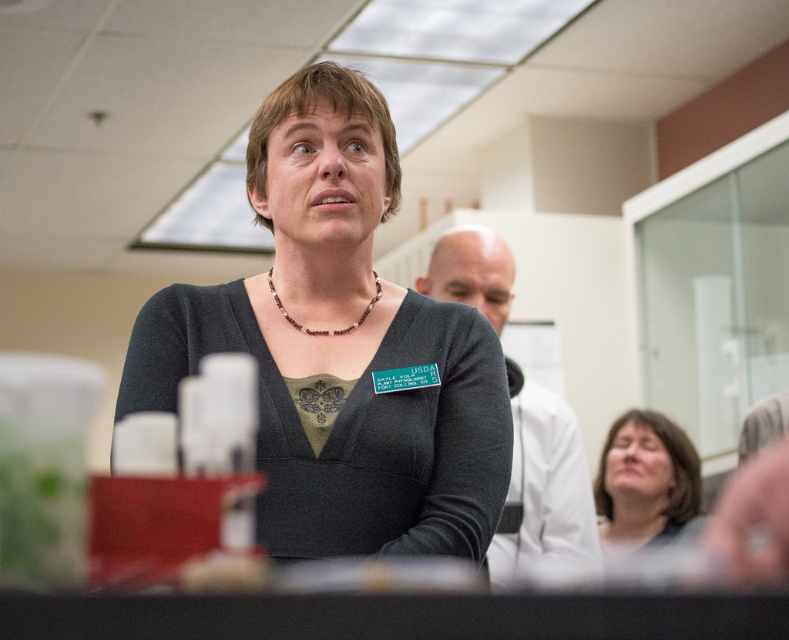
Based on the photo, does matte black sweater at center appear on the right side of matte gray sweater at lower right?

No, matte black sweater at center is not to the right of matte gray sweater at lower right.

Between point (440, 348) and point (647, 468), which one is positioned behind?

The point (647, 468) is behind.

Identify the location of matte black sweater at center. (350, 417).

Is matte gray sweater at lower right above multicolored beaded necklace at center?

No, matte gray sweater at lower right is not above multicolored beaded necklace at center.

Identify the location of matte gray sweater at lower right. (644, 481).

Between point (604, 477) and point (281, 304), which one is positioned in front?

Point (281, 304) is more forward.

I want to click on matte gray sweater at lower right, so click(x=644, y=481).

Can you confirm if matte black sweater at center is bigger than multicolored beaded necklace at center?

Correct, matte black sweater at center is larger in size than multicolored beaded necklace at center.

Can you confirm if matte black sweater at center is smaller than multicolored beaded necklace at center?

Incorrect, matte black sweater at center is not smaller in size than multicolored beaded necklace at center.

Who is more distant from viewer, (x=350, y=445) or (x=301, y=326)?

The point (x=301, y=326) is more distant.

The width and height of the screenshot is (789, 640). Identify the location of matte black sweater at center. (350, 417).